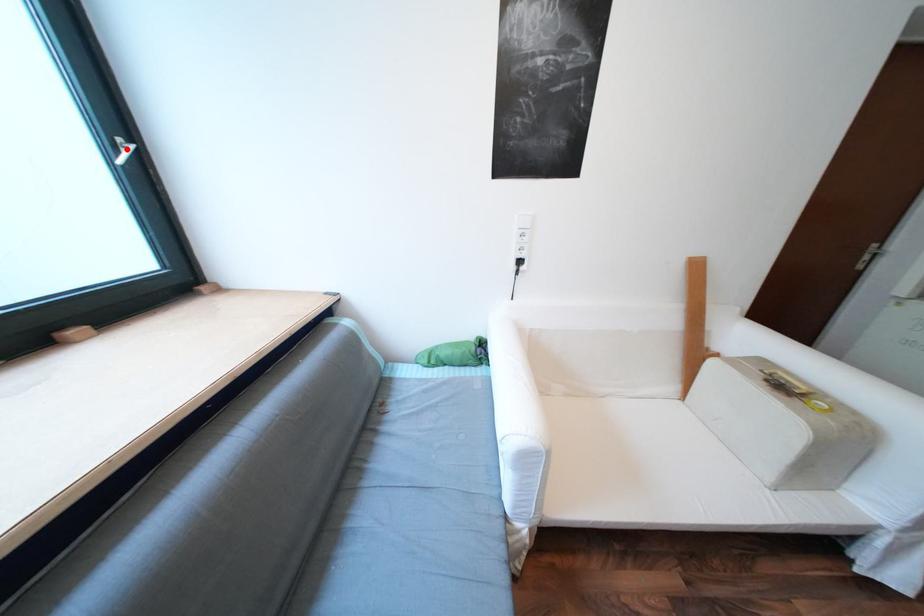
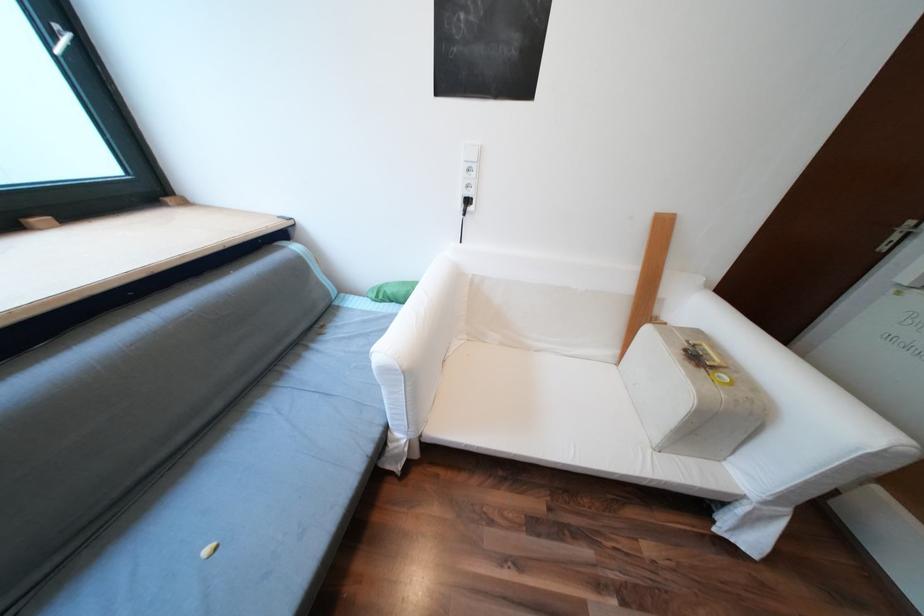
Question: I am providing you with two images of the same scene from different viewpoints. Given a red point in image1, look at the same physical point in image2. Is it:

Choices:
 (A) Closer to the viewpoint
 (B) Farther from the viewpoint

Answer: (B)